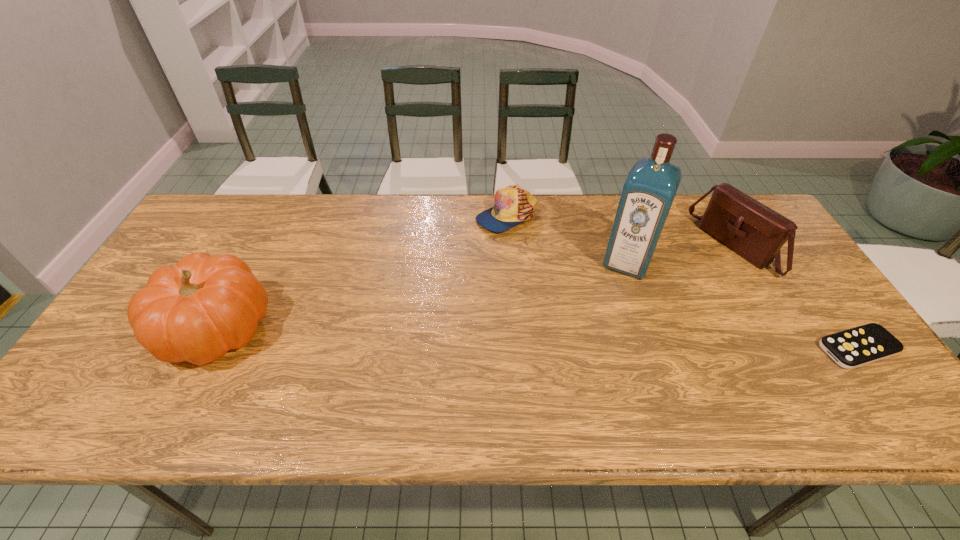
Image resolution: width=960 pixels, height=540 pixels. In order to click on vacant space on the desktop that is between the pumpkin and the remote control and is positioned on the flat label side of the tallest object in this screenshot , I will do `click(593, 340)`.

The image size is (960, 540). In order to click on vacant space on the desktop that is between the leftmost object and the remote control and is positioned on the front flap of the shoulder bag in this screenshot , I will do `click(568, 339)`.

This screenshot has width=960, height=540. I want to click on free space on the desktop that is between the pumpkin and the remote control and is positioned on the bill of the second object from left to right, so (435, 335).